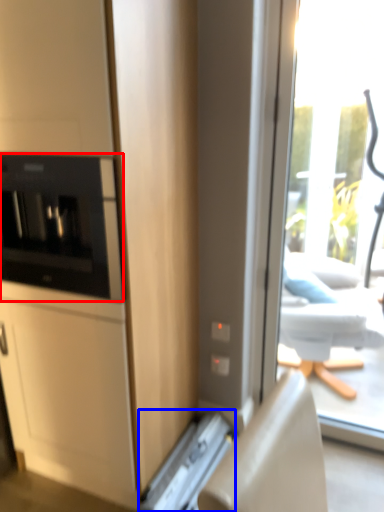
Question: Which of the following is the farthest to the observer, home appliance (highlighted by a red box) or appliance (highlighted by a blue box)?

Choices:
 (A) home appliance
 (B) appliance

Answer: (B)